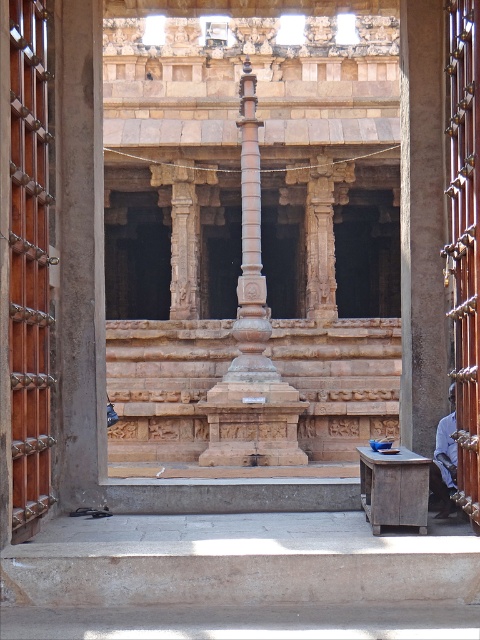
Is polished stone pillar at center further to camera compared to blue fabric shirt at right?

That is True.

Can you confirm if polished stone pillar at center is bigger than blue fabric shirt at right?

Yes, polished stone pillar at center is bigger than blue fabric shirt at right.

Does point (247, 294) come farther from viewer compared to point (430, 470)?

Yes, it is.

Where is `polished stone pillar at center`? The height and width of the screenshot is (640, 480). polished stone pillar at center is located at coordinates (251, 253).